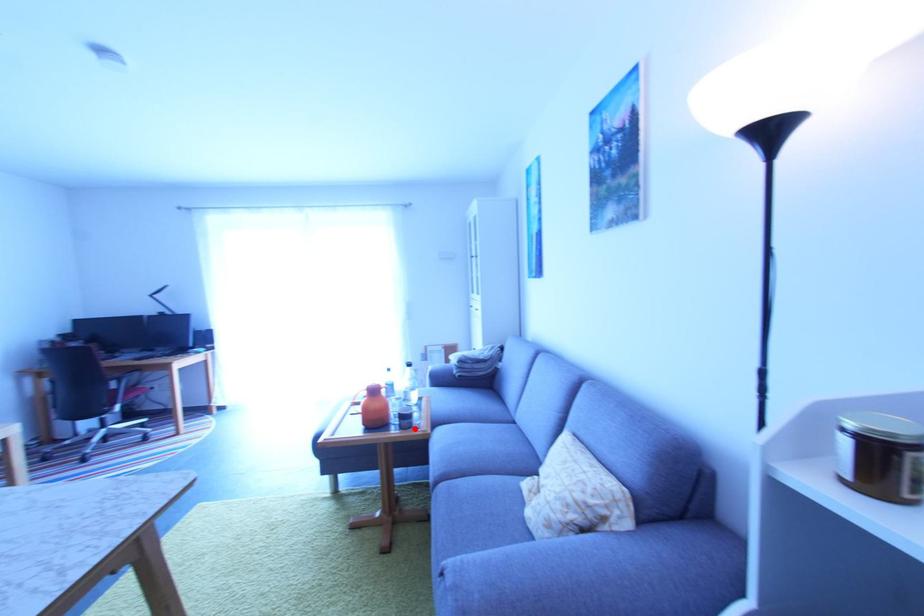
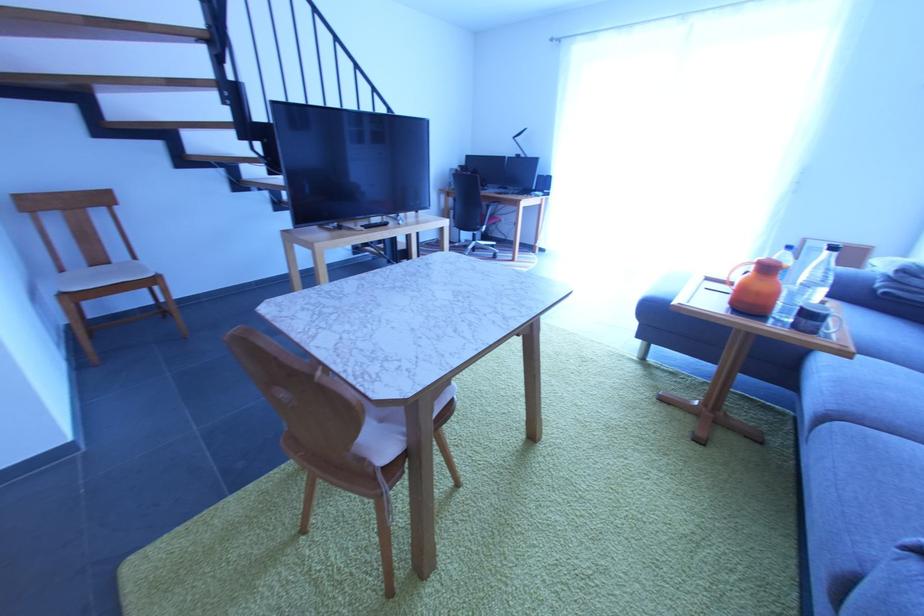
Where in the second image is the point corresponding to the highlighted location from the first image?

(819, 334)